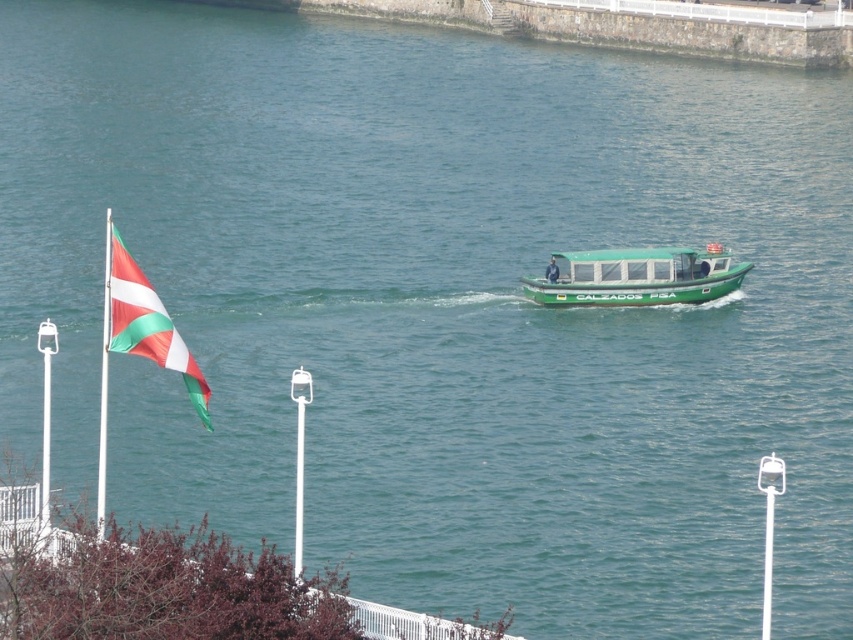
In the scene shown: Does white-green striped flag at left appear on the left side of white plastic flag pole at left?

In fact, white-green striped flag at left is to the right of white plastic flag pole at left.

Is white-green striped flag at left thinner than white plastic flag pole at left?

Correct, white-green striped flag at left's width is less than white plastic flag pole at left's.

Identify the location of white-green striped flag at left. (148, 324).

Is point (677, 276) closer to viewer compared to point (106, 432)?

No.

This screenshot has height=640, width=853. Describe the element at coordinates (637, 276) in the screenshot. I see `green matte boat at center` at that location.

Is point (625, 262) positioned before point (105, 301)?

No, it is behind (105, 301).

The width and height of the screenshot is (853, 640). Identify the location of green matte boat at center. pyautogui.click(x=637, y=276).

Is green matte boat at center wider than white-green striped flag at left?

Correct, the width of green matte boat at center exceeds that of white-green striped flag at left.

Between point (683, 262) and point (126, 336), which one is positioned in front?

Point (126, 336) is more forward.

The image size is (853, 640). Find the location of `green matte boat at center`. green matte boat at center is located at coordinates (637, 276).